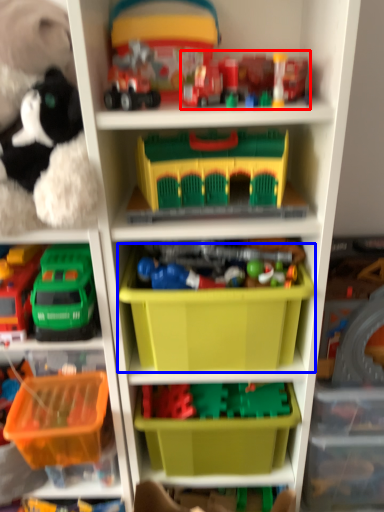
Question: Which point is closer to the camera, toy (highlighted by a red box) or storage box (highlighted by a blue box)?

Choices:
 (A) toy
 (B) storage box

Answer: (A)